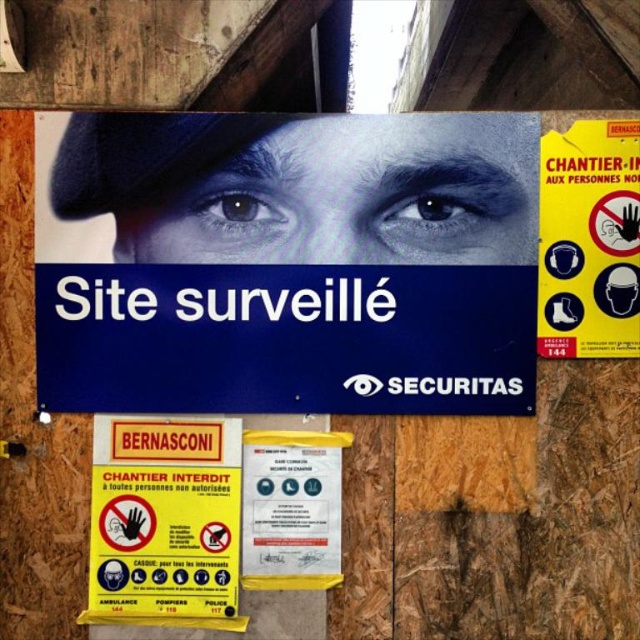
Does yellow paper sign at upper right have a lesser height compared to yellow paper at center?

No.

Who is higher up, yellow paper sign at upper right or yellow paper at center?

Positioned higher is yellow paper sign at upper right.

Between point (627, 317) and point (324, 518), which one is positioned behind?

The point (324, 518) is behind.

The height and width of the screenshot is (640, 640). Find the location of `yellow paper sign at upper right`. yellow paper sign at upper right is located at coordinates (589, 241).

Which of these two, yellow paper sign at upper right or yellow paper sign at lower left, stands shorter?

yellow paper sign at lower left is shorter.

Is yellow paper sign at upper right to the right of yellow paper sign at lower left from the viewer's perspective?

Indeed, yellow paper sign at upper right is positioned on the right side of yellow paper sign at lower left.

The image size is (640, 640). In order to click on yellow paper sign at upper right in this screenshot , I will do `click(589, 241)`.

Looking at this image, who is lower down, yellow paper sign at lower left or yellow paper at center?

yellow paper sign at lower left is lower down.

Is yellow paper sign at lower left to the right of yellow paper at center from the viewer's perspective?

In fact, yellow paper sign at lower left is to the left of yellow paper at center.

Is point (116, 513) positioned behind point (307, 547)?

No, it is not.

Where is `yellow paper sign at lower left`? yellow paper sign at lower left is located at coordinates (164, 545).